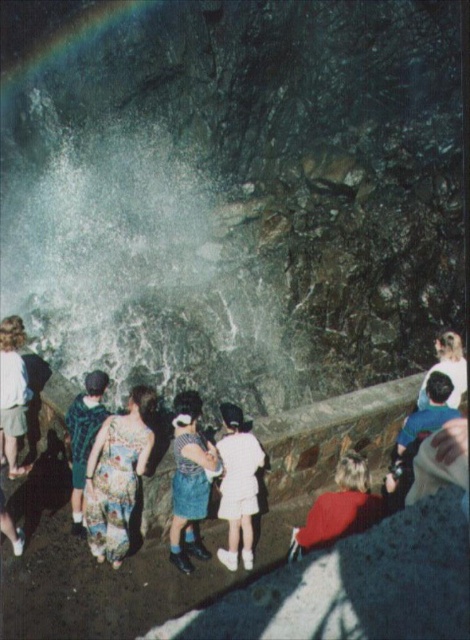
You are standing at the point labeled point [453,378] and want to move towards the waterfall. Is the point labeled point [248,493] in your path?

Yes, the point labeled point [248,493] is in front of point [453,378], so it will be in your path towards the waterfall.

You are a photographer trying to capture a photo of the waterfall with both the floral fabric dress at center and the white matte dress at center in the frame. Which dress should you focus on to ensure it appears larger in the photo?

The floral fabric dress at center is much taller than the white matte dress at center, so focusing on it will make it appear larger in the photo.

You are a photographer trying to capture a photo of the white matte dress at center and the white matte shirt at right. Which object should you focus on first if you want to ensure both are in frame and the taller one is properly framed?

The white matte dress at center should be focused on first since it has a greater height compared to the white matte shirt at right, ensuring proper framing of the taller object.